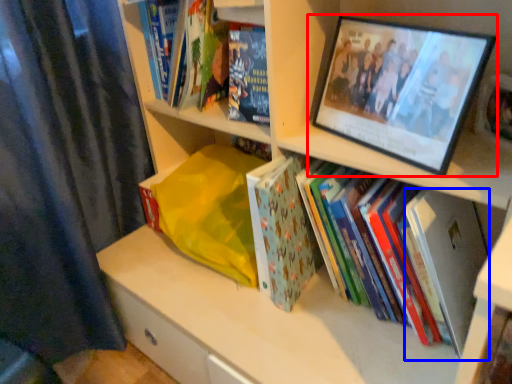
Question: Among these objects, which one is farthest to the camera, picture frame (highlighted by a red box) or paperback book (highlighted by a blue box)?

Choices:
 (A) picture frame
 (B) paperback book

Answer: (B)